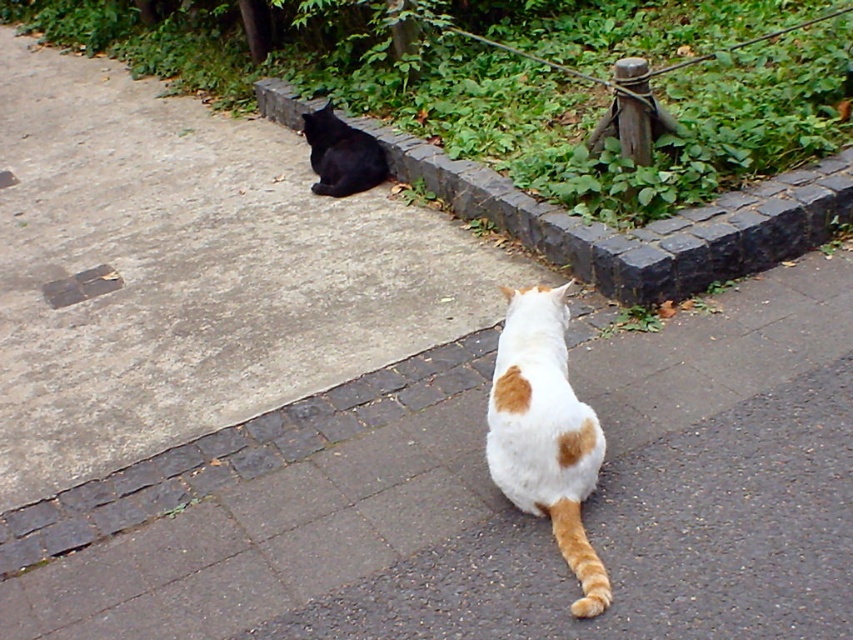
Question: Among these points, which one is farthest from the camera?

Choices:
 (A) (563, 392)
 (B) (402, 148)

Answer: (B)

Question: Is white and orange fur cat at center below shiny black cat at upper left?

Choices:
 (A) no
 (B) yes

Answer: (B)

Question: Which point is closer to the camera?

Choices:
 (A) white and orange fur cat at center
 (B) gray stone curb at upper center
 (C) shiny black cat at upper left

Answer: (A)

Question: Where is gray stone curb at upper center located in relation to shiny black cat at upper left in the image?

Choices:
 (A) below
 (B) above

Answer: (A)

Question: Can you confirm if gray stone curb at upper center is smaller than white and orange fur cat at center?

Choices:
 (A) no
 (B) yes

Answer: (A)

Question: Among these objects, which one is nearest to the camera?

Choices:
 (A) gray stone curb at upper center
 (B) white and orange fur cat at center
 (C) shiny black cat at upper left

Answer: (B)